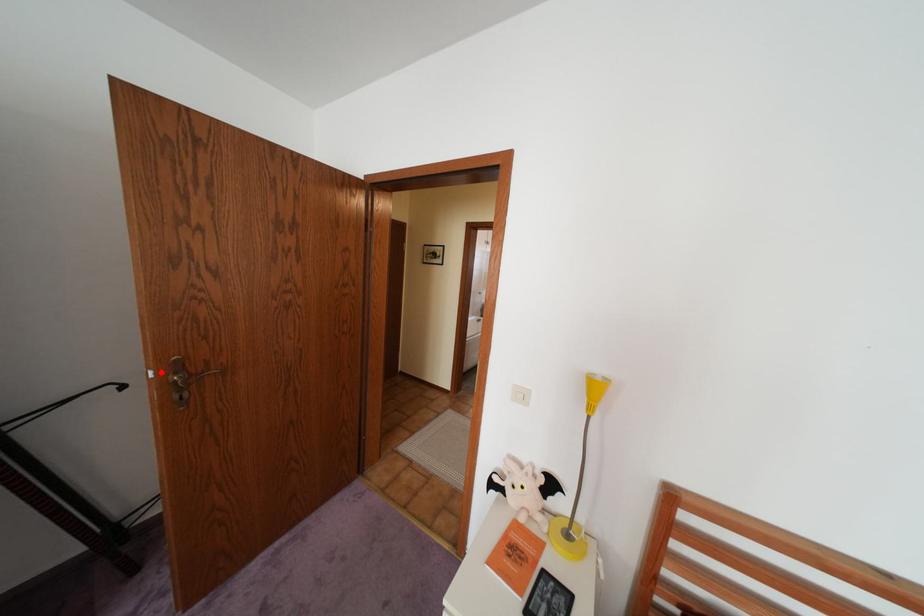
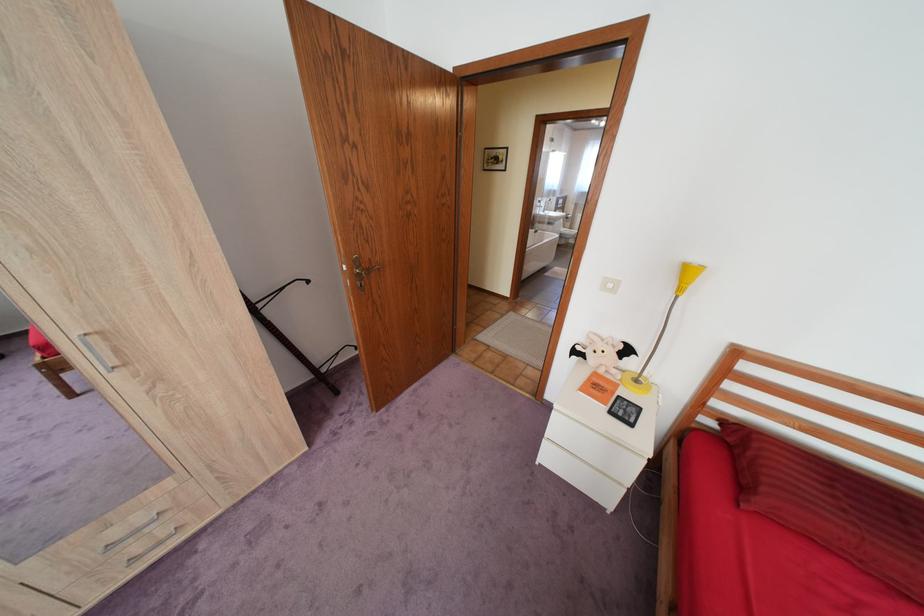
In the second image, find the point that corresponds to the highlighted location in the first image.

(355, 265)